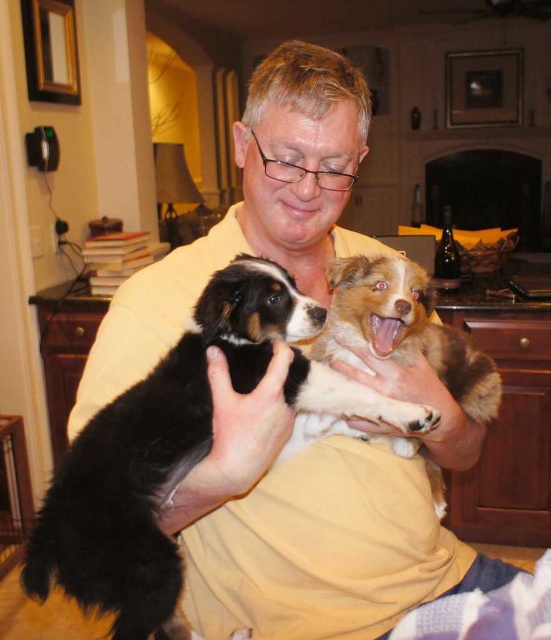
Does black soft fur dog at center have a lesser width compared to brown fuzzy dog at center?

No, black soft fur dog at center is not thinner than brown fuzzy dog at center.

Which of these two, black soft fur dog at center or brown fuzzy dog at center, stands taller?

Standing taller between the two is black soft fur dog at center.

I want to click on black soft fur dog at center, so click(155, 456).